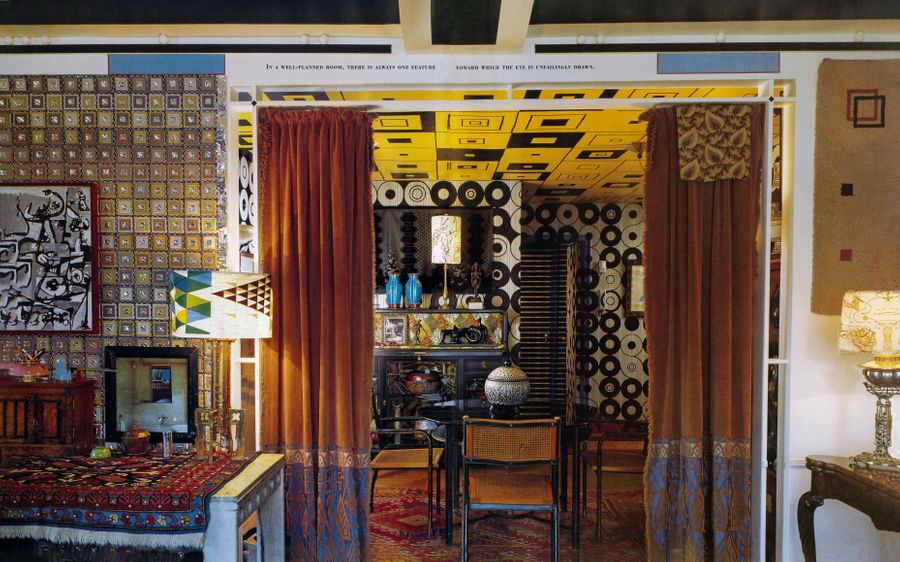
The width and height of the screenshot is (900, 562). In order to click on black and white wall in this screenshot , I will do `click(616, 237)`, `click(634, 353)`, `click(502, 220)`, `click(403, 188)`, `click(244, 194)`.